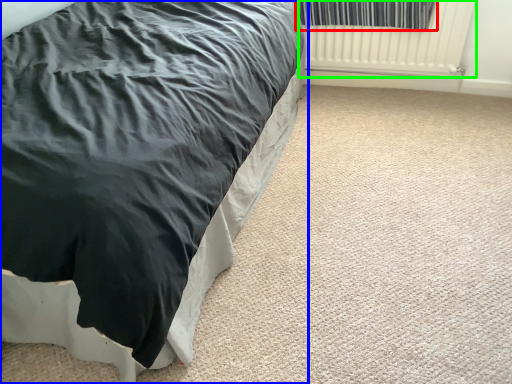
Question: Which is nearer to the curtain (highlighted by a red box)? bed (highlighted by a blue box) or radiator (highlighted by a green box).

Choices:
 (A) bed
 (B) radiator

Answer: (B)